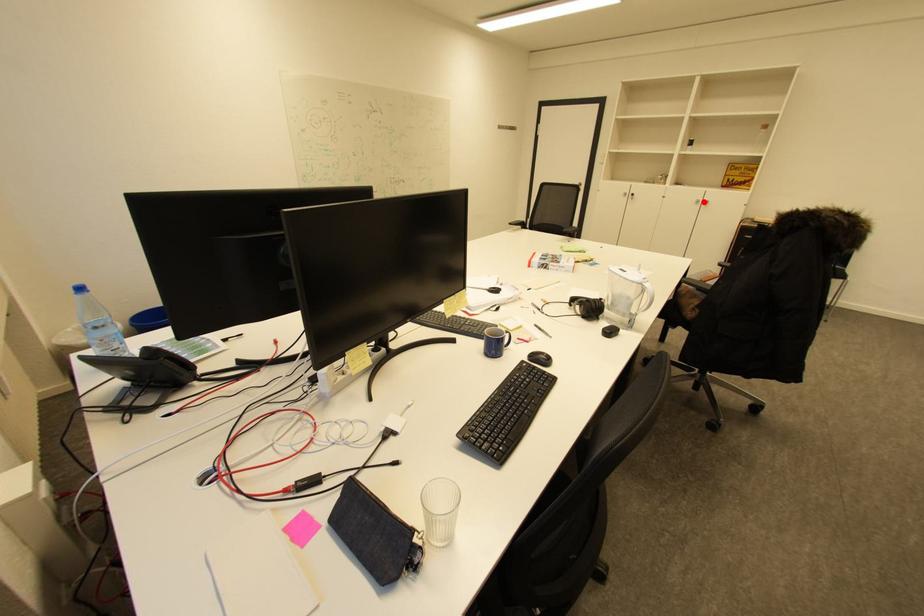
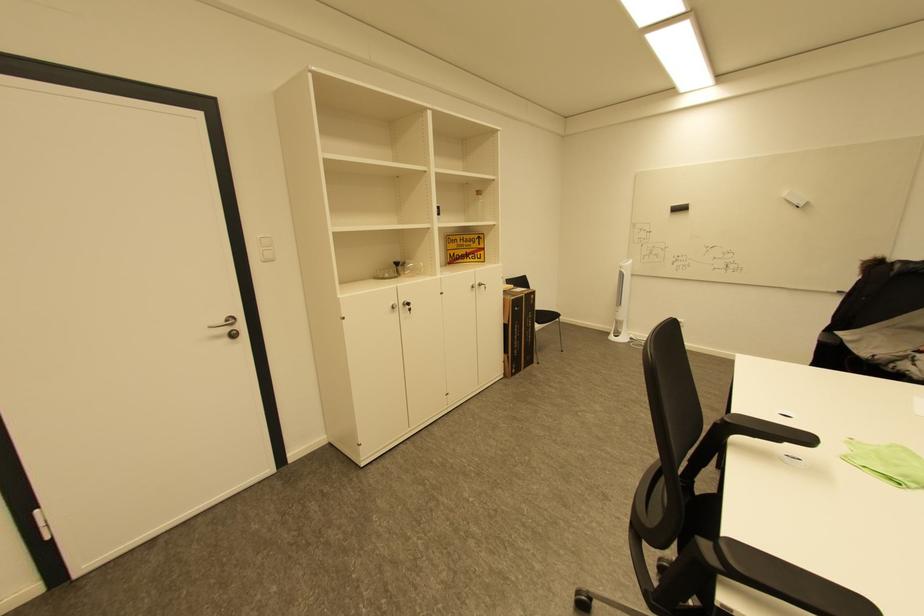
Find the pixel in the second image that matches the highlighted location in the first image.

(479, 286)